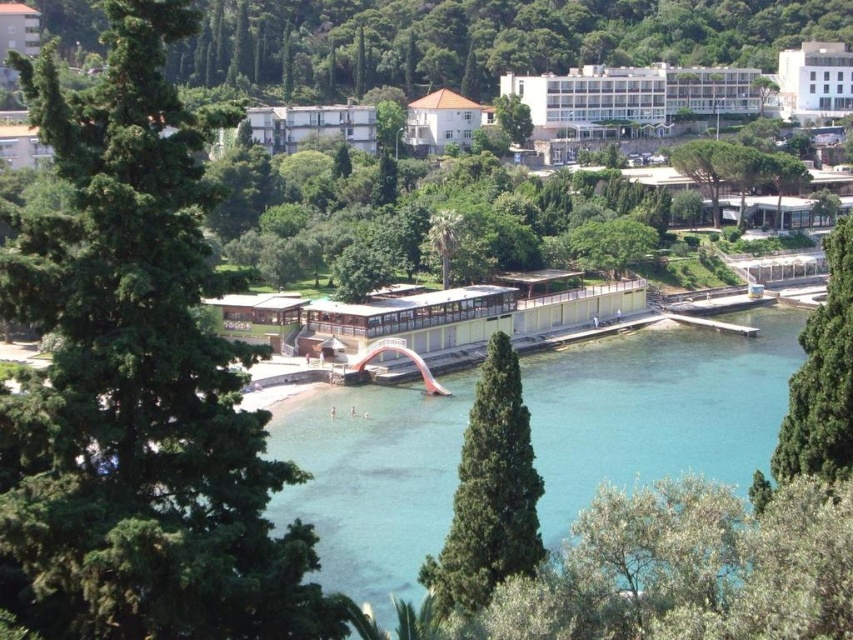
You are a landscape architect designing a new garden. You have to place both the green textured tree at center and the white concrete building at center in the same area. Which object should you place first to ensure there is enough space for both?

You should place the white concrete building at center first because the green textured tree at center occupies less space, so it can be arranged around the building without space issues.

You are standing at the center of the image and want to locate the green leafy tree at left. According to the coordinates provided, in which direction should you look to find it?

The green leafy tree at left is located at coordinates point [144,381], so you should look to the left side of the image to find it.